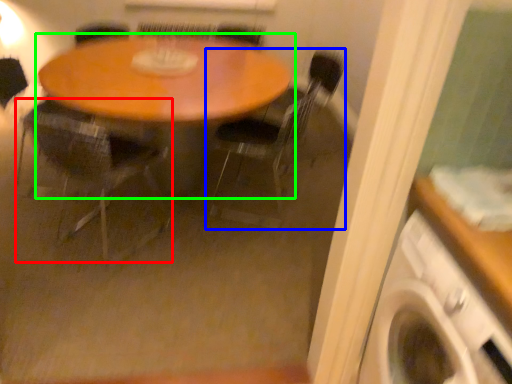
Question: Based on their relative distances, which object is nearer to chair (highlighted by a red box)? Choose from chair (highlighted by a blue box) and table (highlighted by a green box).

Choices:
 (A) chair
 (B) table

Answer: (B)